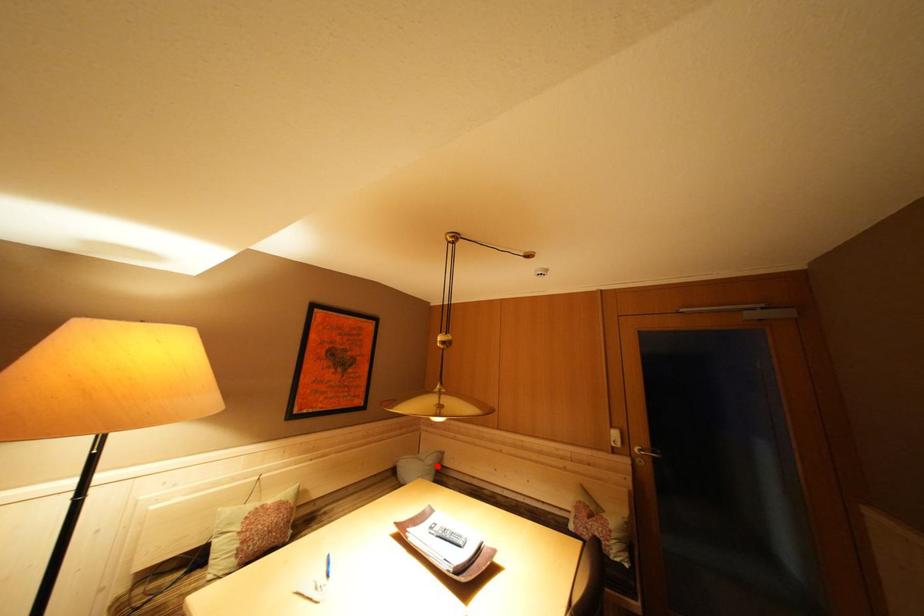
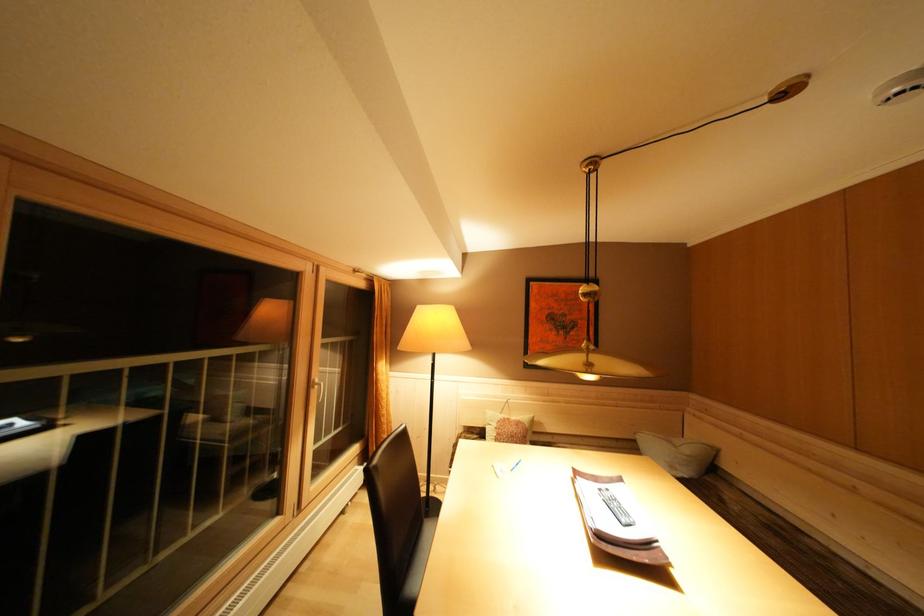
Locate, in the second image, the point that corresponds to the highlighted location in the first image.

(695, 456)